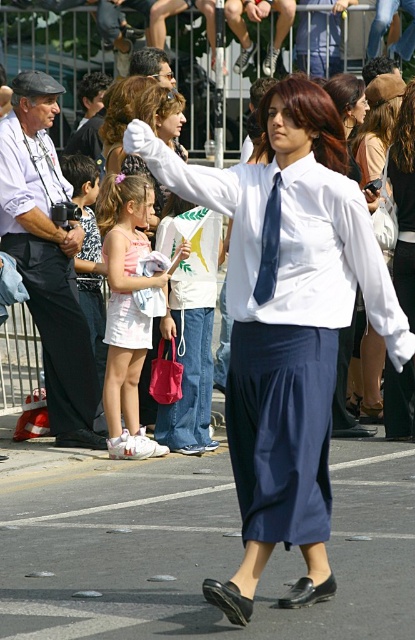
Can you confirm if white smooth dress shirt at center is smaller than white satin dress at center?

Incorrect, white smooth dress shirt at center is not smaller in size than white satin dress at center.

Does white smooth dress shirt at center appear on the left side of white satin dress at center?

In fact, white smooth dress shirt at center is to the right of white satin dress at center.

Locate an element on the screen. white smooth dress shirt at center is located at coordinates (287, 326).

The height and width of the screenshot is (640, 415). Find the location of `white smooth dress shirt at center`. white smooth dress shirt at center is located at coordinates (287, 326).

Does white cotton dress at center have a larger size compared to dark blue silk tie at center?

Correct, white cotton dress at center is larger in size than dark blue silk tie at center.

Between white cotton dress at center and dark blue silk tie at center, which one appears on the left side from the viewer's perspective?

white cotton dress at center is more to the left.

Is point (105, 388) farther from camera compared to point (278, 186)?

That is True.

At what (x,y) coordinates should I click in order to perform the action: click on white cotton dress at center. Please return your answer as a coordinate pair (x, y). Looking at the image, I should click on (127, 308).

Does white smooth dress shirt at center have a smaller size compared to dark blue silk tie at center?

Actually, white smooth dress shirt at center might be larger than dark blue silk tie at center.

Who is higher up, white smooth dress shirt at center or dark blue silk tie at center?

Positioned higher is dark blue silk tie at center.

Measure the distance between point (266, 381) and camera.

The distance of point (266, 381) from camera is 7.47 meters.

The height and width of the screenshot is (640, 415). I want to click on white smooth dress shirt at center, so click(x=287, y=326).